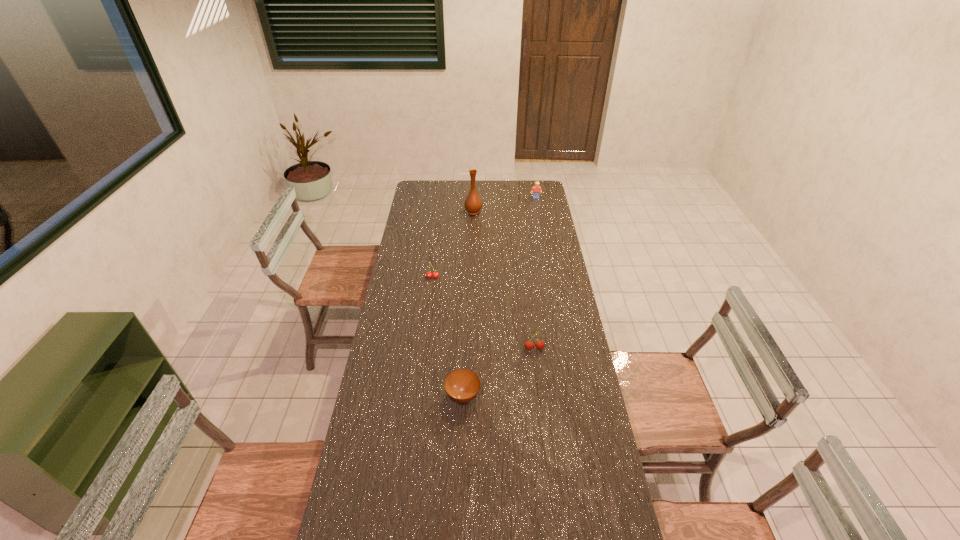
This screenshot has width=960, height=540. Find the location of `free location located 0.170m on the right of the vase`. free location located 0.170m on the right of the vase is located at coordinates (514, 212).

In order to click on vacant region located 0.110m on the front-facing side of the farthest object in this screenshot , I will do `click(538, 210)`.

The image size is (960, 540). Find the location of `free space located on the surface of the right cherry`. free space located on the surface of the right cherry is located at coordinates (544, 437).

At what (x,y) coordinates should I click in order to perform the action: click on free spot located with the stems of the farther cherry pointing upwards. Please return your answer as a coordinate pair (x, y). Looking at the image, I should click on (426, 326).

The width and height of the screenshot is (960, 540). I want to click on free space located 0.110m on the back of the bowl, so click(465, 357).

The image size is (960, 540). Find the location of `object that is at the far edge`. object that is at the far edge is located at coordinates (536, 189).

At what (x,y) coordinates should I click in order to perform the action: click on object positioned at the left edge. Please return your answer as a coordinate pair (x, y). Looking at the image, I should click on (435, 275).

I want to click on Lego that is at the right edge, so click(536, 189).

Image resolution: width=960 pixels, height=540 pixels. Identify the location of cherry that is positioned at the right edge. (529, 345).

This screenshot has height=540, width=960. Find the location of `object located at the far right corner`. object located at the far right corner is located at coordinates point(536,189).